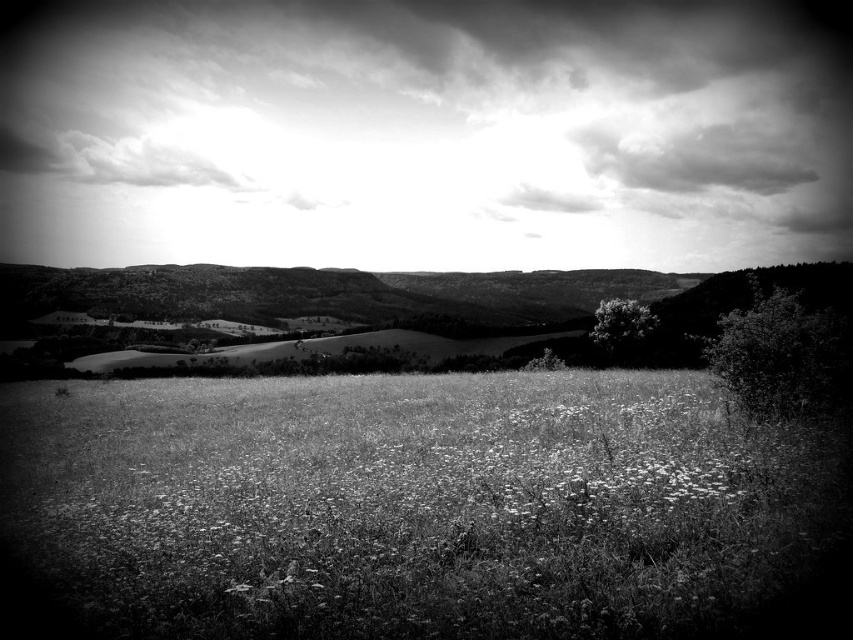
You are standing in the rural scene and want to walk from the point at coordinates point (x=537, y=236) to the point at coordinates point (x=534, y=365). Which direction should you face to move towards the latter point?

To move from point (x=537, y=236) to point (x=534, y=365), you should face towards the right since point (x=534, y=365) is located to the right of point (x=537, y=236) in the image.

You are standing in the middle of the field of wildflowers and grass in the foreground. Looking up, you see the cloudy sky at upper center and the white textured tree at center. Which object is higher in the scene?

The cloudy sky at upper center is positioned over the white textured tree at center, so it is higher in the scene.